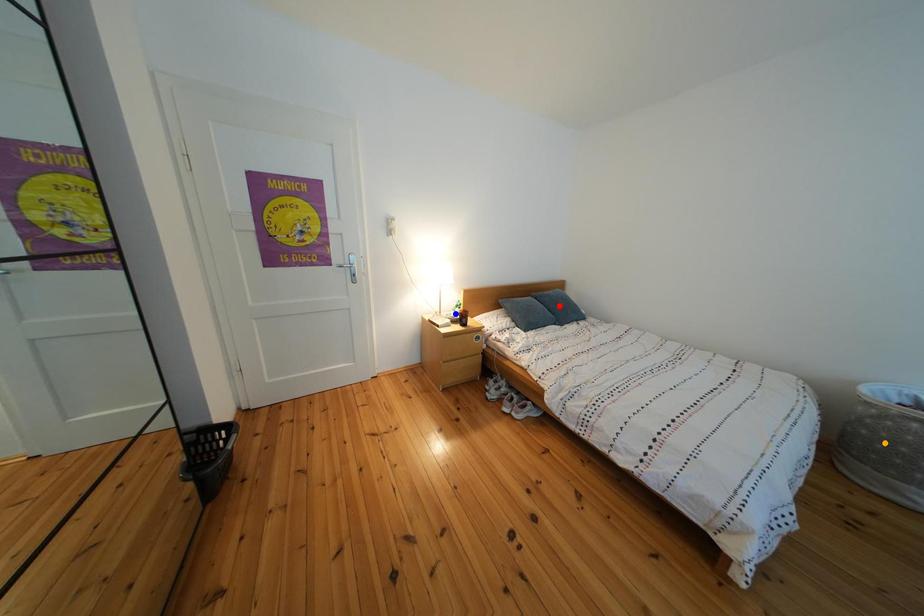
Consider the image. Order these from nearest to farthest:
1. red point
2. orange point
3. blue point

orange point
blue point
red point